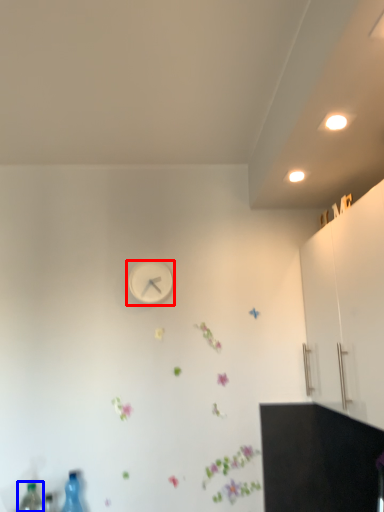
Question: Which of the following is the closest to the observer, wall clock (highlighted by a red box) or bottle (highlighted by a blue box)?

Choices:
 (A) wall clock
 (B) bottle

Answer: (B)